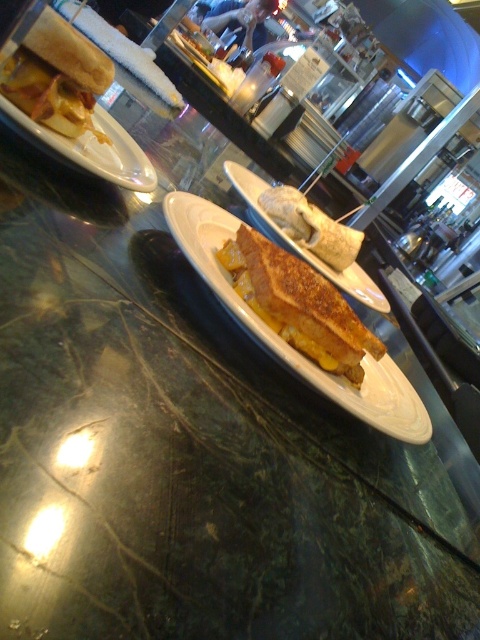
Question: Is matte white plate at upper left to the right of matte brown toast at center from the viewer's perspective?

Choices:
 (A) no
 (B) yes

Answer: (A)

Question: Where is golden-brown toasted sandwich at center located in relation to matte white plate at upper left in the image?

Choices:
 (A) left
 (B) right

Answer: (B)

Question: Which point is closer to the camera?

Choices:
 (A) (330, 278)
 (B) (199, 228)
 (C) (69, 81)
 (D) (348, 381)

Answer: (C)

Question: Which of these objects is positioned farthest from the matte brown toast at center?

Choices:
 (A) matte brown bread at upper left
 (B) golden brown bread at center
 (C) matte white plate at upper left

Answer: (A)

Question: Can you confirm if matte white plate at upper left is positioned to the left of matte brown toast at center?

Choices:
 (A) no
 (B) yes

Answer: (B)

Question: Among these points, which one is nearest to the camera?

Choices:
 (A) (328, 241)
 (B) (144, 177)
 (C) (261, 316)
 (D) (331, 275)

Answer: (C)